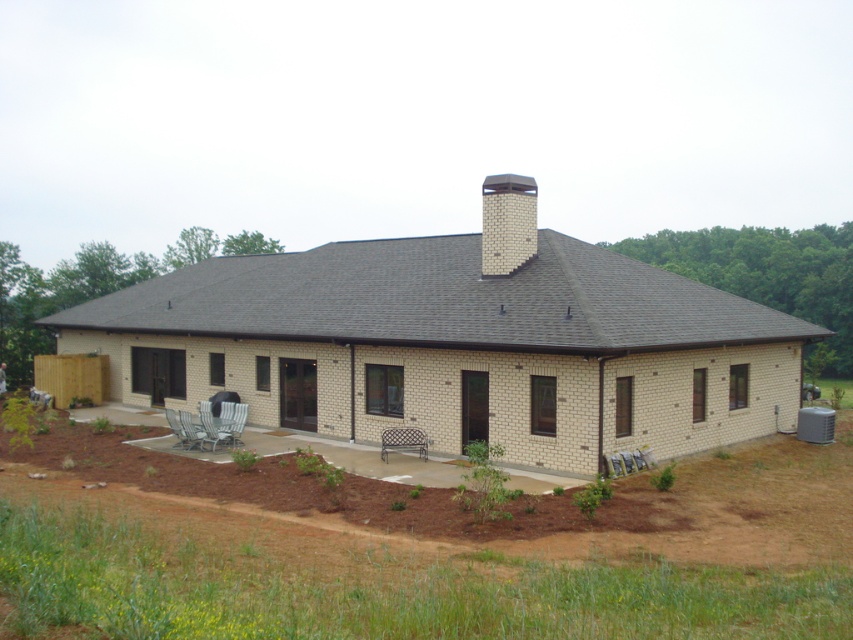
Question: Is metallic silver bench at center smaller than metallic silver chair at lower left?

Choices:
 (A) no
 (B) yes

Answer: (A)

Question: Which of these objects is positioned closest to the white brick chimney at upper center?

Choices:
 (A) brown mulch at lower center
 (B) metallic silver chair at lower left

Answer: (B)

Question: Does white brick chimney at upper center appear on the left side of metallic silver bench at center?

Choices:
 (A) yes
 (B) no

Answer: (B)

Question: Observing the image, what is the correct spatial positioning of brown mulch at lower center in reference to white brick chimney at upper center?

Choices:
 (A) left
 (B) right

Answer: (A)

Question: Which point is farther from the camera taking this photo?

Choices:
 (A) (416, 444)
 (B) (189, 422)
 (C) (714, 632)

Answer: (B)

Question: Considering the real-world distances, which object is farthest from the metallic silver chair at lower left?

Choices:
 (A) brown mulch at lower center
 (B) metallic silver bench at center

Answer: (A)